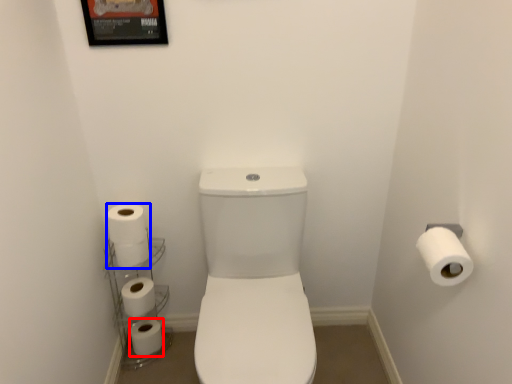
Question: Which object appears closest to the camera in this image, toilet paper (highlighted by a red box) or toilet paper (highlighted by a blue box)?

Choices:
 (A) toilet paper
 (B) toilet paper

Answer: (B)